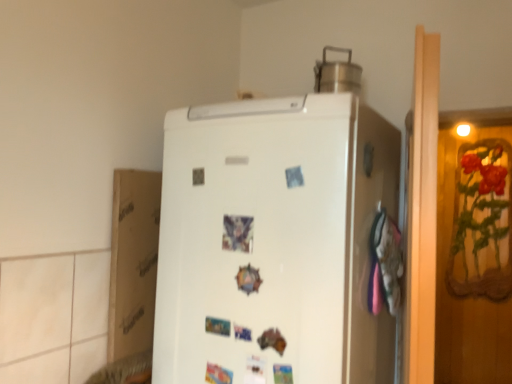
Question: Considering the relative sizes of white matte refrigerator at center and brushed metal pot at upper center in the image provided, is white matte refrigerator at center wider than brushed metal pot at upper center?

Choices:
 (A) yes
 (B) no

Answer: (A)

Question: Is white matte refrigerator at center further to camera compared to brushed metal pot at upper center?

Choices:
 (A) no
 (B) yes

Answer: (A)

Question: Does white matte refrigerator at center appear on the right side of brushed metal pot at upper center?

Choices:
 (A) no
 (B) yes

Answer: (A)

Question: From the image's perspective, does white matte refrigerator at center appear higher than brushed metal pot at upper center?

Choices:
 (A) no
 (B) yes

Answer: (A)

Question: Does white matte refrigerator at center have a smaller size compared to brushed metal pot at upper center?

Choices:
 (A) no
 (B) yes

Answer: (A)

Question: Is brushed metal pot at upper center inside white matte refrigerator at center?

Choices:
 (A) yes
 (B) no

Answer: (B)

Question: Does white matte refrigerator at center have a larger size compared to white cardboard at left?

Choices:
 (A) no
 (B) yes

Answer: (B)

Question: From a real-world perspective, is white matte refrigerator at center on white cardboard at left?

Choices:
 (A) yes
 (B) no

Answer: (A)

Question: Is white cardboard at left at the back of white matte refrigerator at center?

Choices:
 (A) no
 (B) yes

Answer: (A)

Question: Is white matte refrigerator at center thinner than white cardboard at left?

Choices:
 (A) no
 (B) yes

Answer: (A)

Question: Is white matte refrigerator at center wider than white cardboard at left?

Choices:
 (A) yes
 (B) no

Answer: (A)

Question: Does white matte refrigerator at center have a lesser height compared to white cardboard at left?

Choices:
 (A) no
 (B) yes

Answer: (A)

Question: Is brushed metal pot at upper center at the right side of white matte refrigerator at center?

Choices:
 (A) yes
 (B) no

Answer: (A)